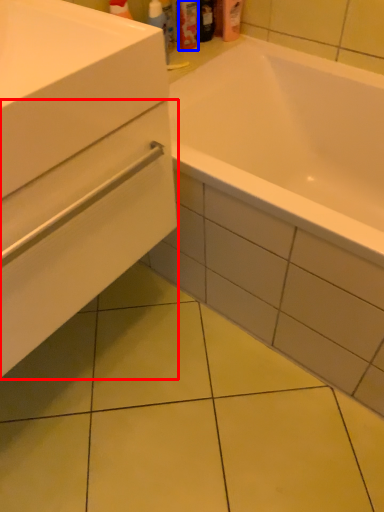
Question: Which object is closer to the camera taking this photo, drawer (highlighted by a red box) or toiletry (highlighted by a blue box)?

Choices:
 (A) drawer
 (B) toiletry

Answer: (A)